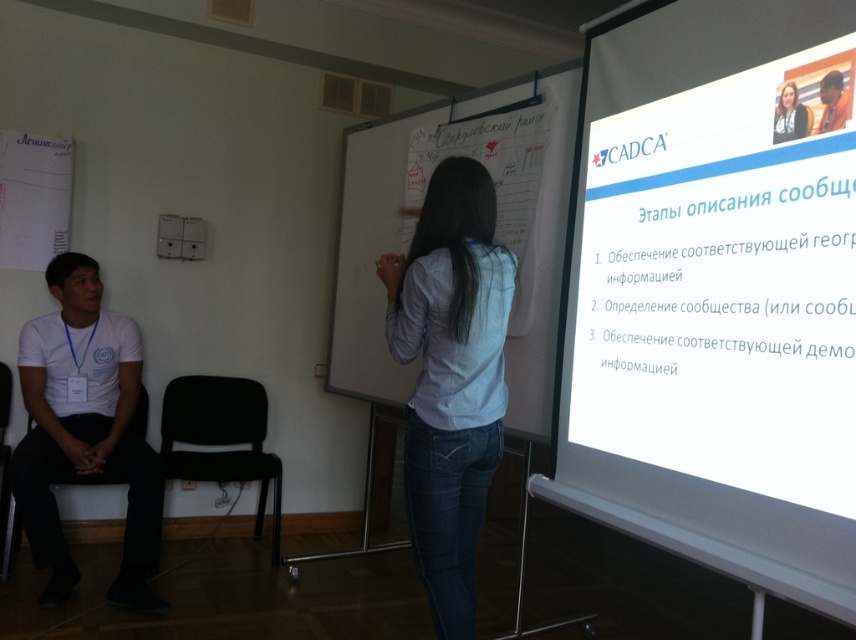
Does light blue denim jeans at center appear over black plastic chair at lower left?

Correct, light blue denim jeans at center is located above black plastic chair at lower left.

Locate an element on the screen. light blue denim jeans at center is located at coordinates (450, 378).

The height and width of the screenshot is (640, 856). What are the coordinates of `light blue denim jeans at center` in the screenshot? It's located at (450, 378).

Can you confirm if white paper at right is positioned above white cotton shirt at left?

Correct, white paper at right is located above white cotton shirt at left.

Between white paper at right and white cotton shirt at left, which one is positioned higher?

white paper at right is higher up.

Does point (709, 285) come farther from viewer compared to point (113, 412)?

No, it is not.

At what (x,y) coordinates should I click in order to perform the action: click on white paper at right. Please return your answer as a coordinate pair (x, y). This screenshot has width=856, height=640. Looking at the image, I should click on (715, 292).

The image size is (856, 640). What do you see at coordinates (3, 461) in the screenshot? I see `black plastic chair at left` at bounding box center [3, 461].

Measure the distance between black plastic chair at left and matte black hair at upper right.

11.21 feet

Locate an element on the screen. black plastic chair at left is located at coordinates (3, 461).

Locate an element on the screen. black plastic chair at left is located at coordinates (3, 461).